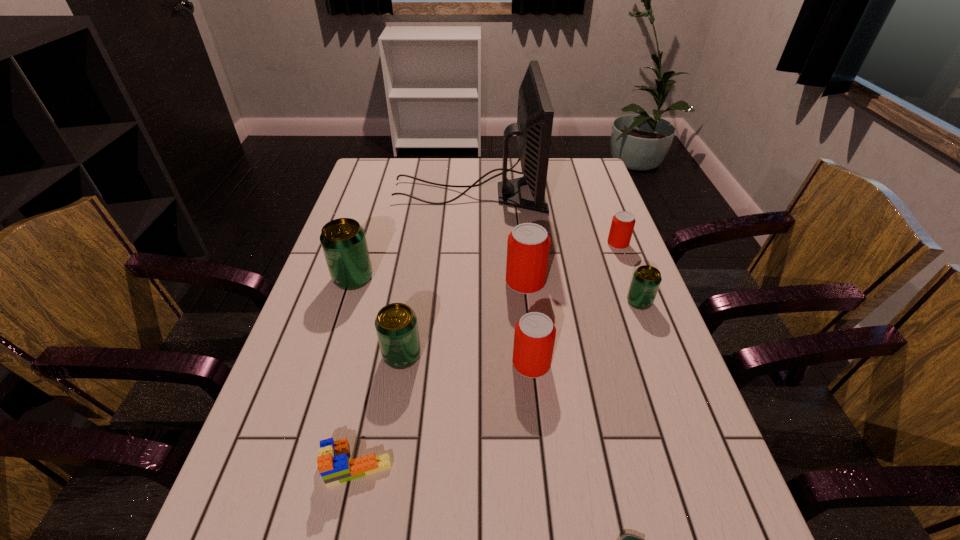
Locate an element on the screen. Image resolution: width=960 pixels, height=540 pixels. computer monitor is located at coordinates (533, 129).

I want to click on the farthest object, so click(x=533, y=129).

Find the location of a particular element. The image size is (960, 540). the biggest red beer can is located at coordinates click(528, 246).

Image resolution: width=960 pixels, height=540 pixels. I want to click on the leftmost green beer can, so click(343, 240).

Identify the location of the farthest green beer can. (343, 240).

Find the location of a particular element. the second smallest red beer can is located at coordinates (534, 337).

Image resolution: width=960 pixels, height=540 pixels. Find the location of `the second beer can from left to right`. the second beer can from left to right is located at coordinates (396, 325).

Image resolution: width=960 pixels, height=540 pixels. I want to click on the second biggest green beer can, so click(396, 325).

You are a GUI agent. You are given a task and a screenshot of the screen. Output one action in this format:
    pyautogui.click(x=<x>, y=<y>)
    Task: Click on the rightmost green beer can
    
    Given the screenshot: What is the action you would take?
    pyautogui.click(x=646, y=280)

The width and height of the screenshot is (960, 540). Identify the location of the second nearest green beer can. (646, 280).